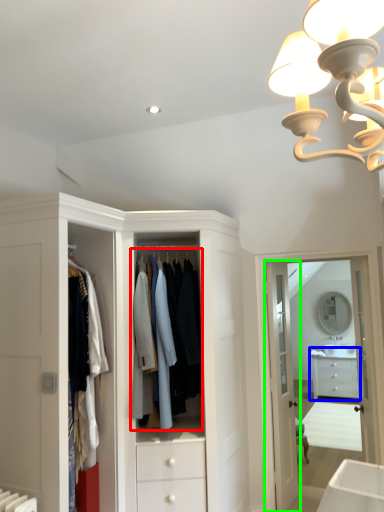
Question: Which object is the farthest from clothing (highlighted by a red box)? Choose among these: chest of drawers (highlighted by a blue box) or door (highlighted by a green box).

Choices:
 (A) chest of drawers
 (B) door

Answer: (A)